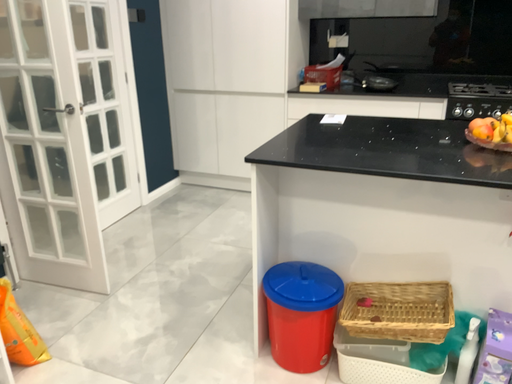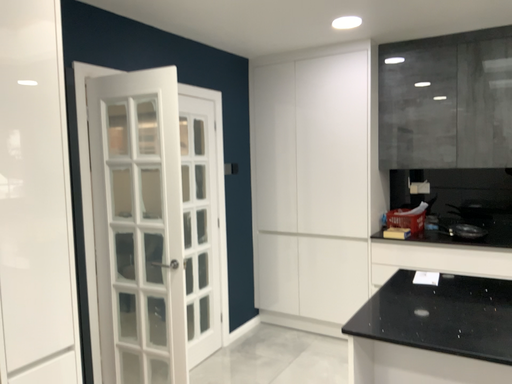
Question: How did the camera likely rotate when shooting the video?

Choices:
 (A) rotated right
 (B) rotated left

Answer: (B)